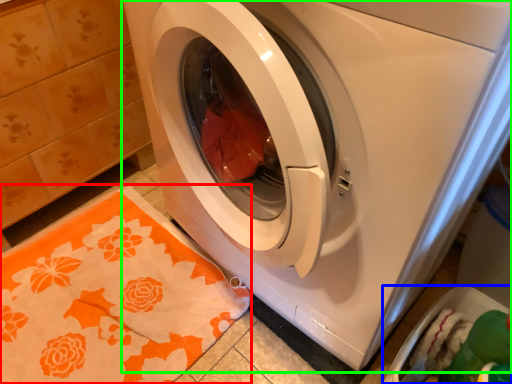
Question: Which object is the farthest from blanket (highlighted by a red box)? Choose among these: dish washer (highlighted by a blue box) or washing machine (highlighted by a green box).

Choices:
 (A) dish washer
 (B) washing machine

Answer: (A)